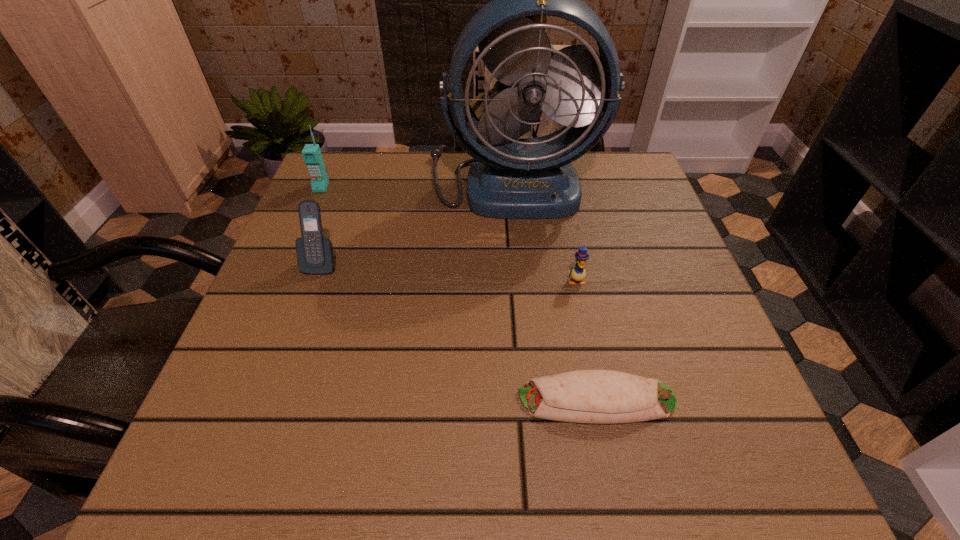
The height and width of the screenshot is (540, 960). I want to click on blank space located 0.150m on the front-facing side of the third tallest object, so click(295, 338).

You are a GUI agent. You are given a task and a screenshot of the screen. Output one action in this format:
    pyautogui.click(x=<x>, y=<y>)
    Task: Click on the vacant area located 0.280m on the face of the second shortest object, where the monocle is placed
    
    Given the screenshot: What is the action you would take?
    pyautogui.click(x=606, y=427)

Find the location of a particular element. The height and width of the screenshot is (540, 960). free location located 0.290m at the bitten end of the shortest object is located at coordinates (329, 400).

Identify the location of vacant space located at the bitten end of the shortest object. (414, 400).

This screenshot has width=960, height=540. Identify the location of vacant space located at the bitten end of the shortest object. (420, 400).

Where is `fan that is at the far edge`? This screenshot has height=540, width=960. fan that is at the far edge is located at coordinates (513, 178).

Where is `cellular telephone that is at the far edge`? Image resolution: width=960 pixels, height=540 pixels. cellular telephone that is at the far edge is located at coordinates (311, 153).

The image size is (960, 540). What are the coordinates of `fan that is positioned at the right edge` in the screenshot? It's located at (513, 178).

Identify the location of burrito situated at the right edge. This screenshot has height=540, width=960. (586, 396).

Locate an element on the screen. The image size is (960, 540). object that is positioned at the far left corner is located at coordinates (311, 153).